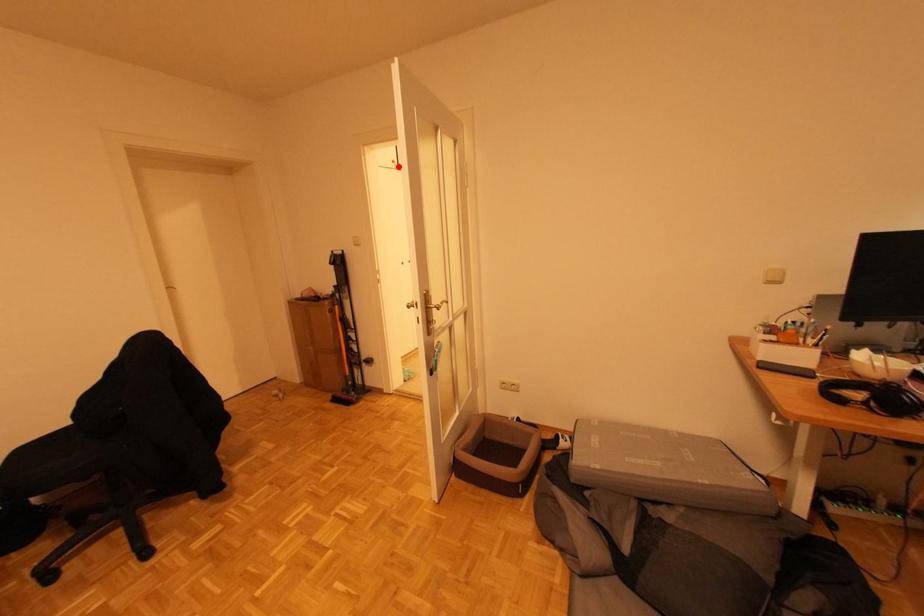
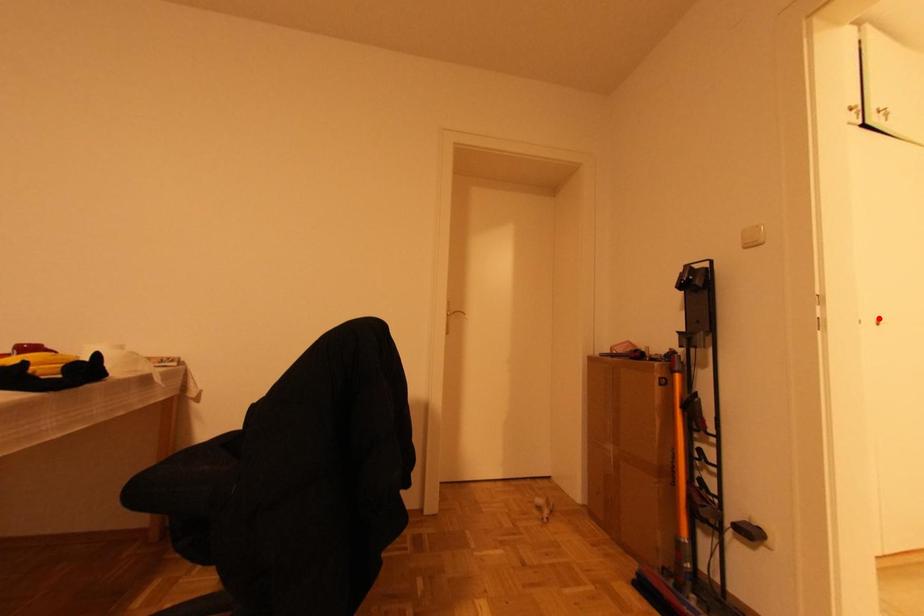
I am providing you with two images of the same scene from different viewpoints. A red point is marked on the first image and another point is marked on the second image. Does the point marked in image1 correspond to the same location as the one in image2?

No